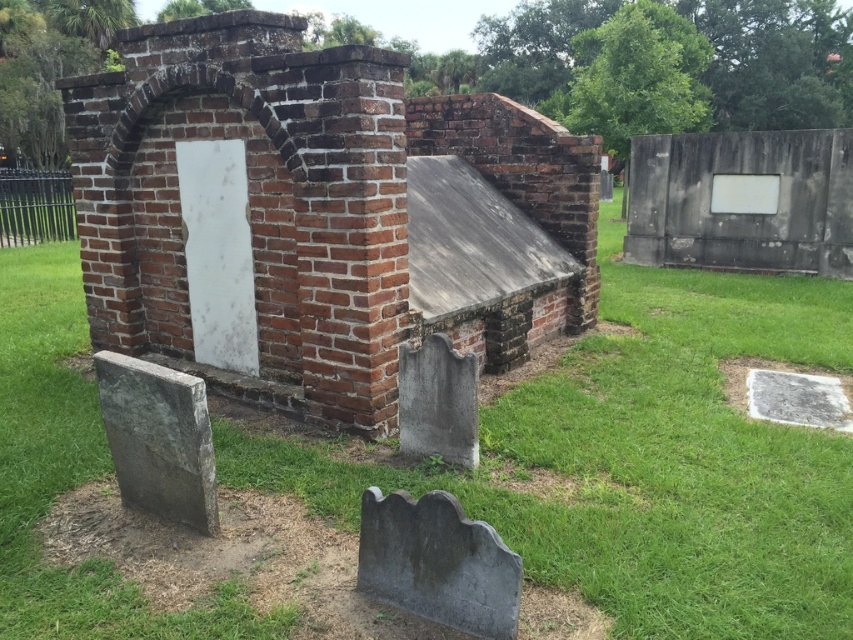
Can you confirm if gray stone gravestone at lower left is smaller than gray stone gravestone at center?

Yes, gray stone gravestone at lower left is smaller than gray stone gravestone at center.

From the picture: Is gray stone gravestone at lower left thinner than gray stone gravestone at center?

In fact, gray stone gravestone at lower left might be wider than gray stone gravestone at center.

Who is more forward, (134, 483) or (457, 420)?

Point (134, 483)

The image size is (853, 640). Find the location of `gray stone gravestone at lower left`. gray stone gravestone at lower left is located at coordinates (x=158, y=440).

Between green grass at center and gray stone gravestone at lower left, which one appears on the left side from the viewer's perspective?

Positioned to the left is gray stone gravestone at lower left.

Is point (665, 554) closer to viewer compared to point (119, 468)?

That is True.

Locate an element on the screen. The height and width of the screenshot is (640, 853). green grass at center is located at coordinates (648, 461).

Does gray stone gravestone at lower center have a lesser width compared to gray stone gravestone at lower left?

Yes, gray stone gravestone at lower center is thinner than gray stone gravestone at lower left.

Can you confirm if gray stone gravestone at lower center is wider than gray stone gravestone at lower left?

In fact, gray stone gravestone at lower center might be narrower than gray stone gravestone at lower left.

Is point (450, 513) farther from camera compared to point (132, 490)?

No, (450, 513) is closer to viewer.

The height and width of the screenshot is (640, 853). Identify the location of gray stone gravestone at lower center. (437, 563).